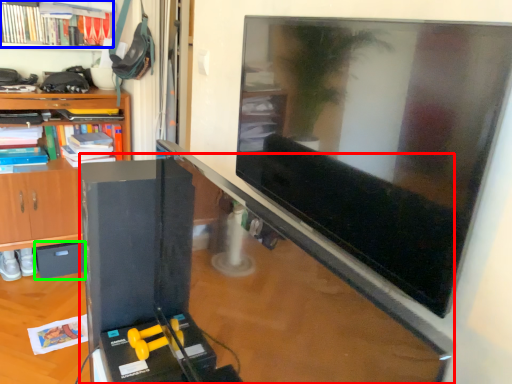
Question: Based on their relative distances, which object is nearer to computer desk (highlighted by a red box)? Choose from book (highlighted by a blue box) and drawer (highlighted by a green box).

Choices:
 (A) book
 (B) drawer

Answer: (B)